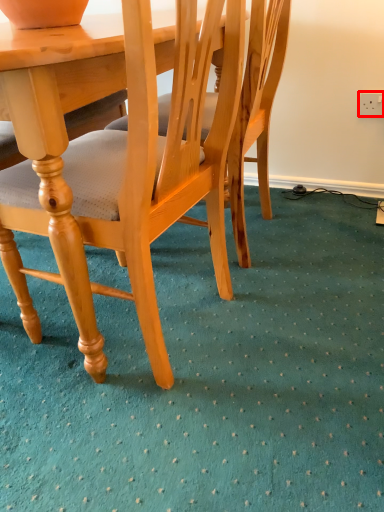
Question: Observing the image, what is the correct spatial positioning of power outlet (annotated by the red box) in reference to chair?

Choices:
 (A) right
 (B) left

Answer: (A)